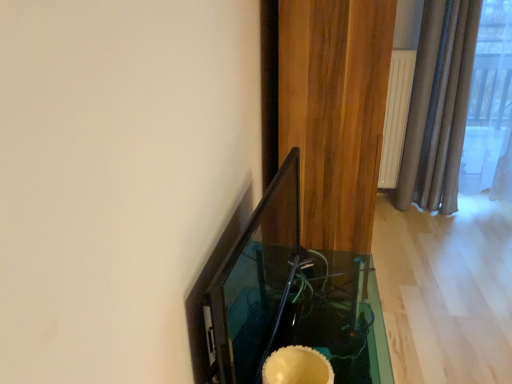
Question: Considering their positions, is transparent glass table at center located in front of or behind brown wood curtain at right?

Choices:
 (A) behind
 (B) front

Answer: (B)

Question: Based on their positions, is transparent glass table at center located to the left or right of brown wood curtain at right?

Choices:
 (A) right
 (B) left

Answer: (B)

Question: From the image's perspective, relative to brown wood curtain at right, is transparent glass table at center above or below?

Choices:
 (A) below
 (B) above

Answer: (A)

Question: Based on their sizes in the image, would you say brown wood curtain at right is bigger or smaller than transparent glass table at center?

Choices:
 (A) small
 (B) big

Answer: (B)

Question: Considering the positions of point (385, 81) and point (284, 264), is point (385, 81) closer or farther from the camera than point (284, 264)?

Choices:
 (A) closer
 (B) farther

Answer: (B)

Question: In the image, is brown wood curtain at right on the left side or the right side of transparent glass table at center?

Choices:
 (A) right
 (B) left

Answer: (A)

Question: Which is correct: brown wood curtain at right is inside transparent glass table at center, or outside of it?

Choices:
 (A) outside
 (B) inside

Answer: (A)